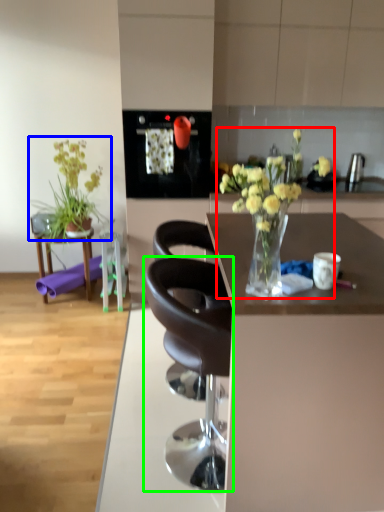
Question: Which is farther away from floral arrangement (highlighted by a red box)? houseplant (highlighted by a blue box) or chair (highlighted by a green box)?

Choices:
 (A) houseplant
 (B) chair

Answer: (A)